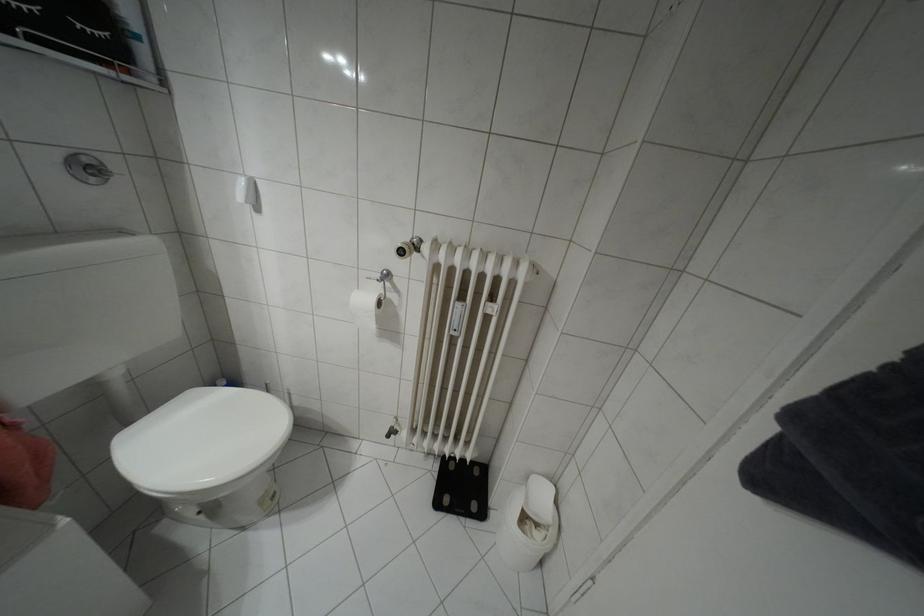
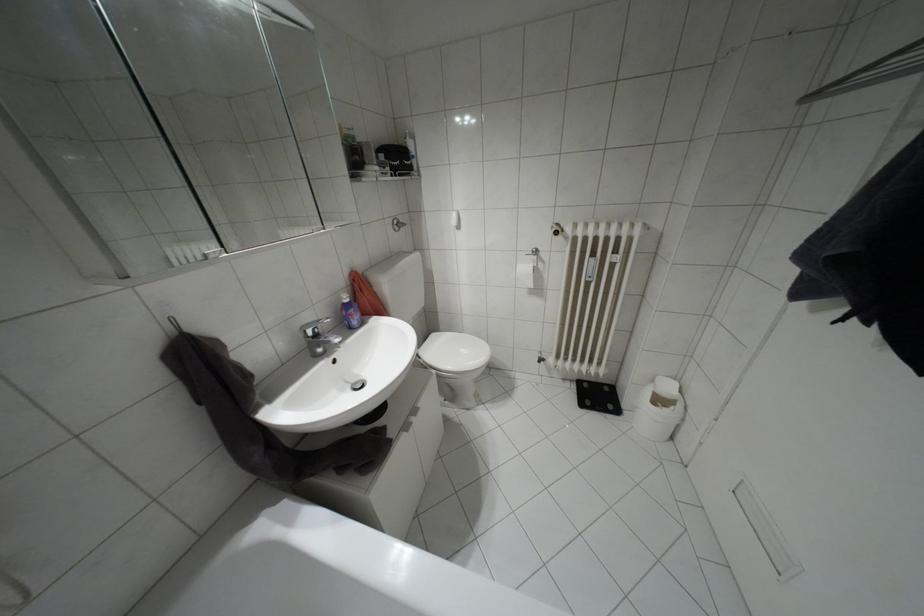
Where in the second image is the point corresponding to point 371,325 from the first image?

(530, 284)